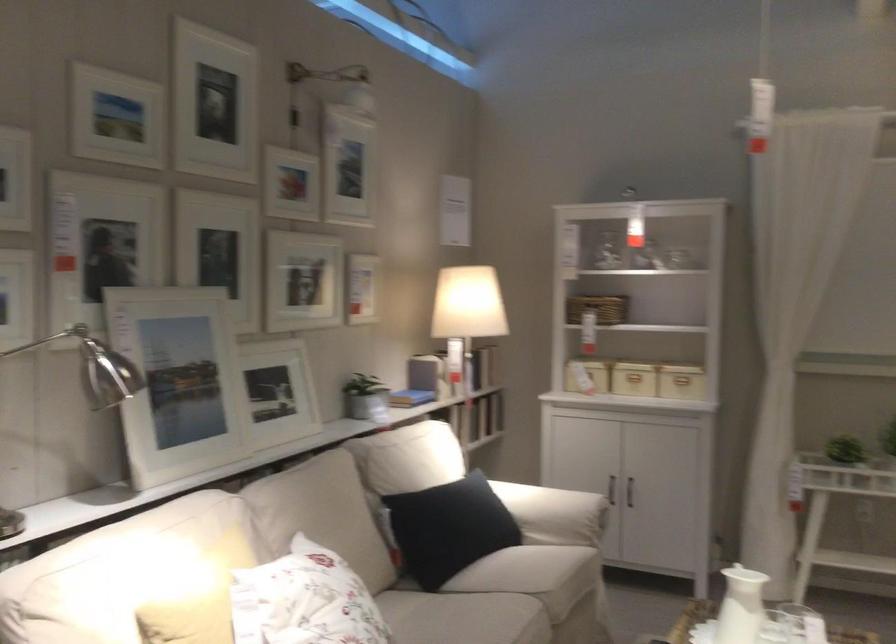
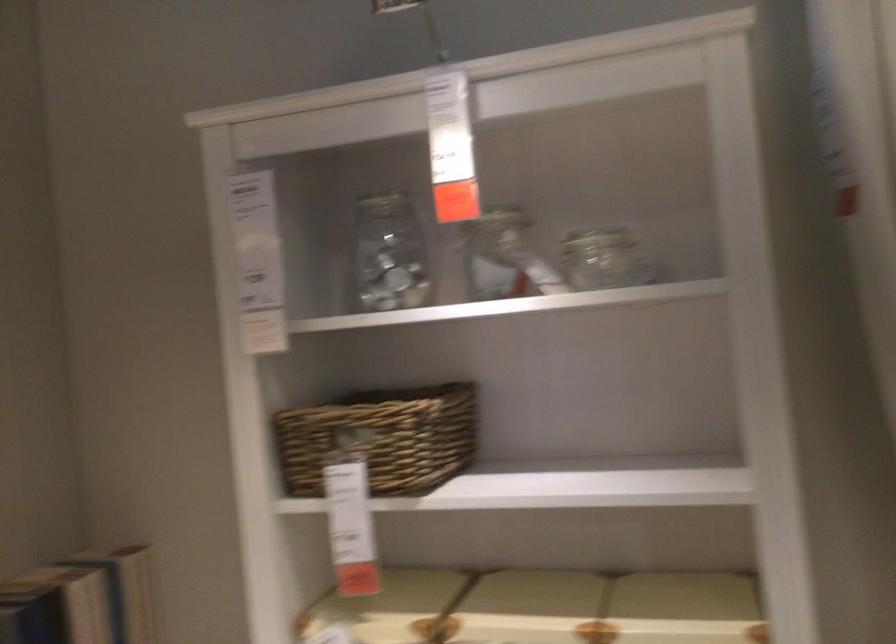
In the second image, find the point that corresponds to (x=692, y=232) in the first image.

(597, 238)